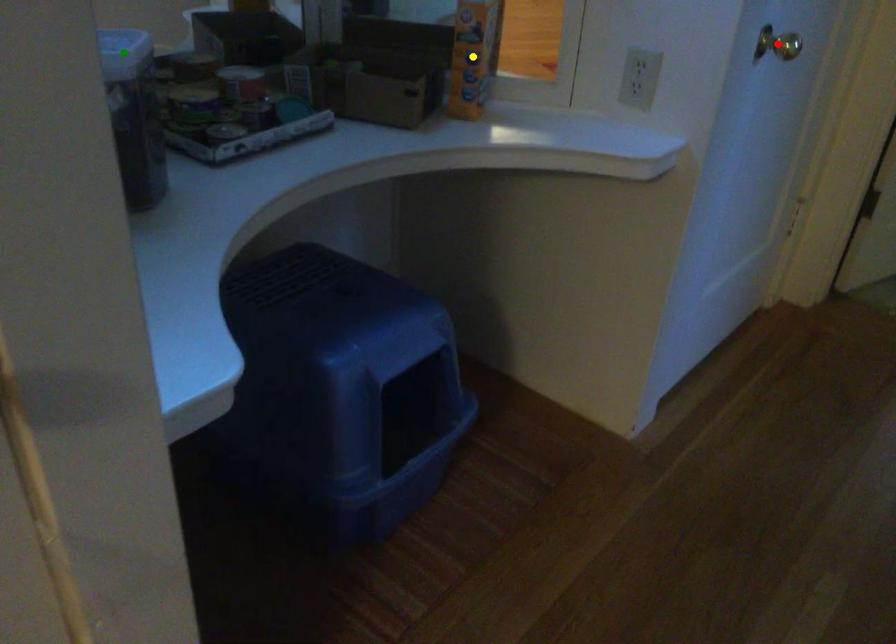
Looking at this image, order these from nearest to farthest:
red point, green point, yellow point

red point, yellow point, green point